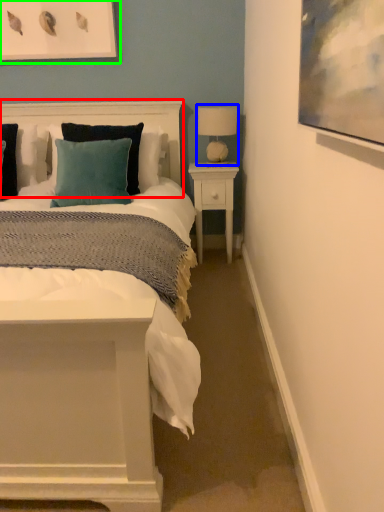
Question: Considering the real-world distances, which object is closest to headboard (highlighted by a red box)? table lamp (highlighted by a blue box) or picture frame (highlighted by a green box).

Choices:
 (A) table lamp
 (B) picture frame

Answer: (B)